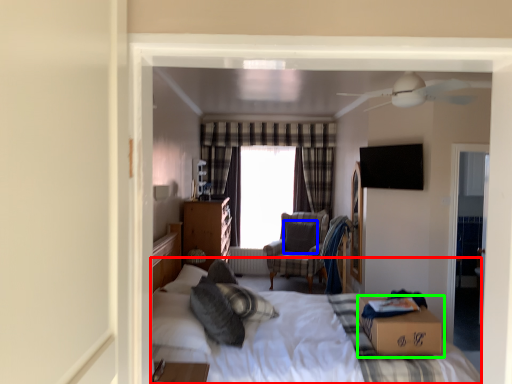
Question: Considering the real-world distances, which object is farthest from bed (highlighted by a red box)? pillow (highlighted by a blue box) or box (highlighted by a green box)?

Choices:
 (A) pillow
 (B) box

Answer: (A)